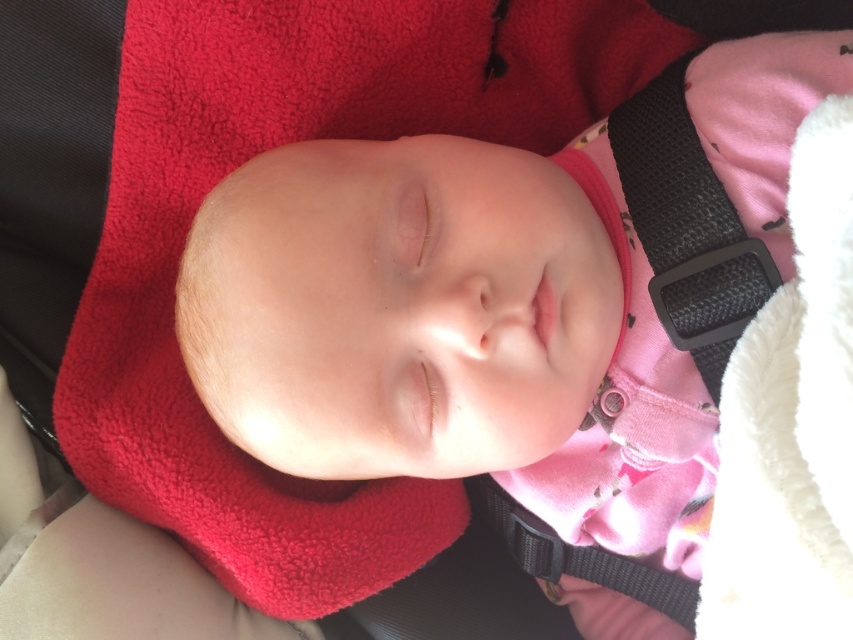
Who is taller, black textured strap at upper right or black fabric strap at lower center?

black textured strap at upper right

Who is more forward, (683, 102) or (514, 548)?

Positioned in front is point (683, 102).

Between point (672, 273) and point (583, 579), which one is positioned behind?

The point (583, 579) is more distant.

Identify the location of black textured strap at upper right. (688, 227).